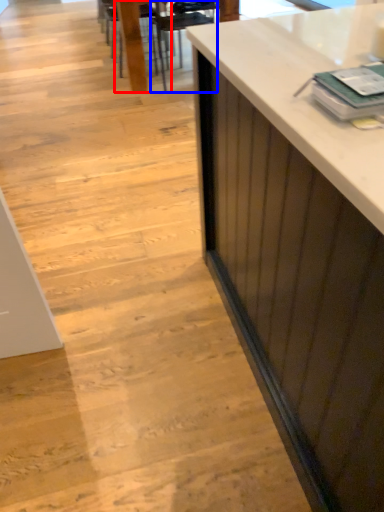
Question: Which of the following is the farthest to the observer, chair (highlighted by a red box) or armchair (highlighted by a blue box)?

Choices:
 (A) chair
 (B) armchair

Answer: (A)